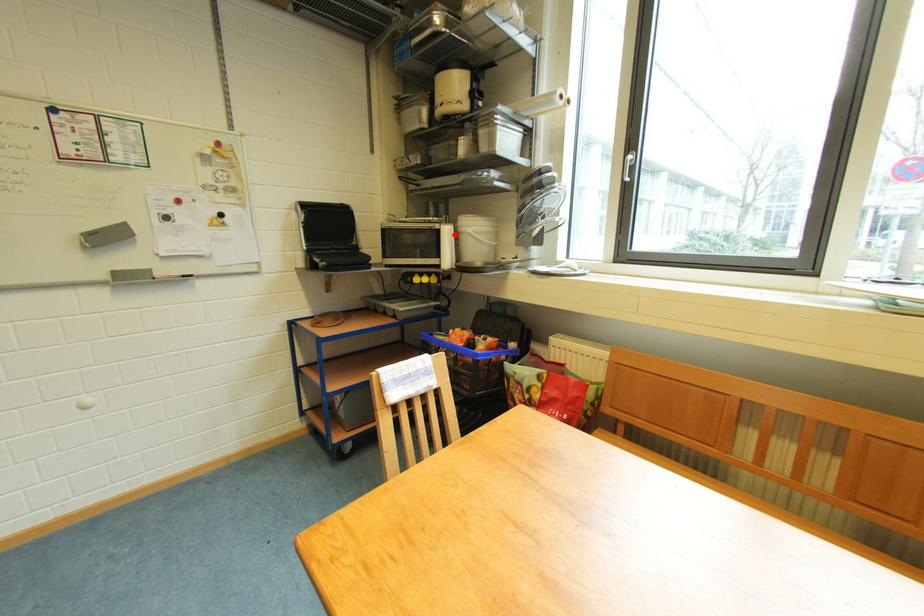
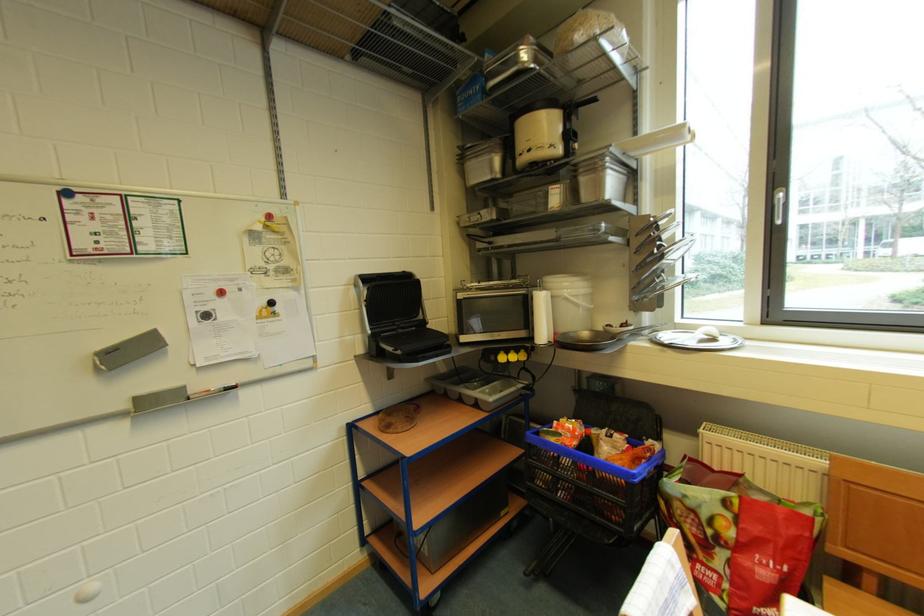
In the second image, find the point that corresponds to the highlighted location in the first image.

(548, 302)